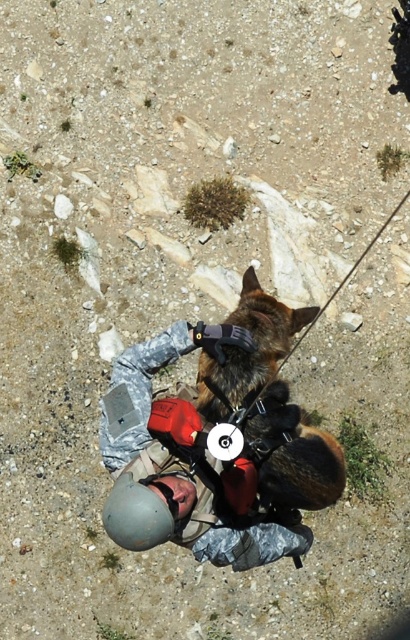
You are a drone operator observing the rappelling scene from above. You need to locate the camouflage fabric helmet at center. What are its coordinates?

The camouflage fabric helmet at center is located at coordinates point (166, 458).

You are a safety inspector reviewing the rappelling gear of two individuals. You notice the camouflage fabric helmet at center and the gray matte helmet at lower center. Which helmet has a larger size?

The camouflage fabric helmet at center is larger in size than the gray matte helmet at lower center.